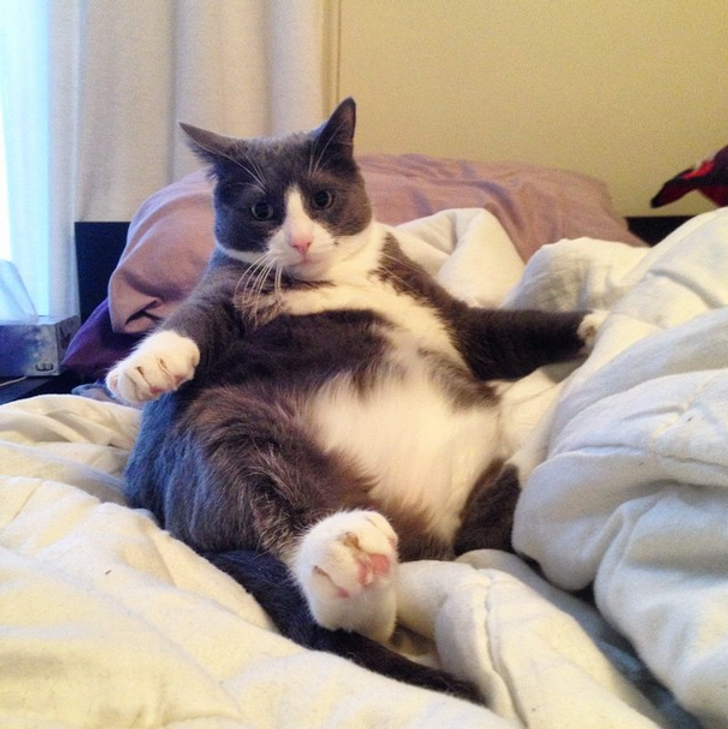
Identify the location of bed. (194, 643).